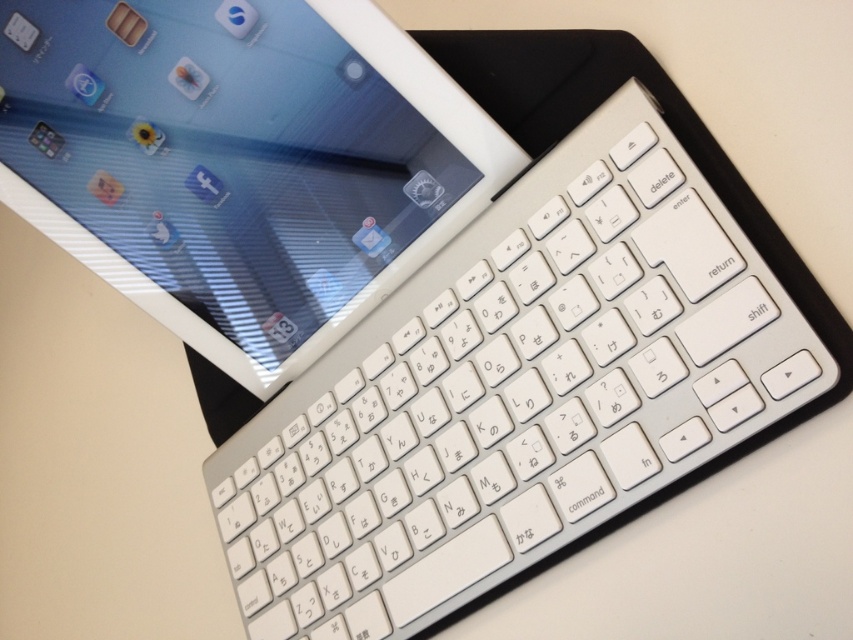
Question: Can you confirm if white plastic keyboard at upper center is positioned below white glossy tablet at upper left?

Choices:
 (A) yes
 (B) no

Answer: (A)

Question: Which point is closer to the camera taking this photo?

Choices:
 (A) 613,433
 (B) 125,49

Answer: (A)

Question: Is white plastic keyboard at upper center bigger than white glossy tablet at upper left?

Choices:
 (A) yes
 (B) no

Answer: (A)

Question: Which of the following is the farthest from the observer?

Choices:
 (A) white glossy tablet at upper left
 (B) white plastic keyboard at upper center

Answer: (A)

Question: Among these objects, which one is nearest to the camera?

Choices:
 (A) white plastic keyboard at upper center
 (B) white glossy tablet at upper left

Answer: (A)

Question: Is white plastic keyboard at upper center positioned before white glossy tablet at upper left?

Choices:
 (A) yes
 (B) no

Answer: (A)